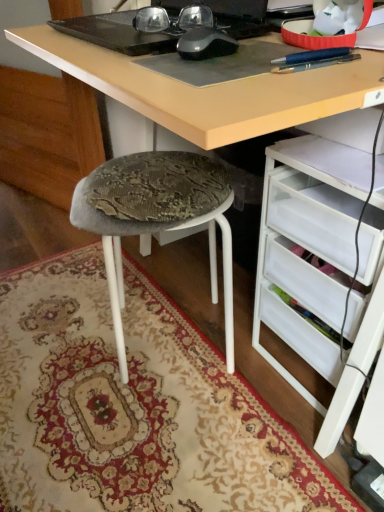
Question: Choose the correct answer: Is black matte mouse at center inside white plastic drawers at lower right or outside it?

Choices:
 (A) inside
 (B) outside

Answer: (B)

Question: From their relative heights in the image, would you say black matte mouse at center is taller or shorter than white plastic drawers at lower right?

Choices:
 (A) tall
 (B) short

Answer: (B)

Question: Which of these objects is positioned closest to the white plastic drawers at lower right?

Choices:
 (A) black matte mouse at center
 (B) textured fabric stool at lower left
 (C) matte black glasses at upper center
 (D) carpeted rug at lower left

Answer: (B)

Question: Which object is positioned farthest from the textured fabric stool at lower left?

Choices:
 (A) white plastic drawers at lower right
 (B) carpeted rug at lower left
 (C) black matte mouse at center
 (D) matte black glasses at upper center

Answer: (C)